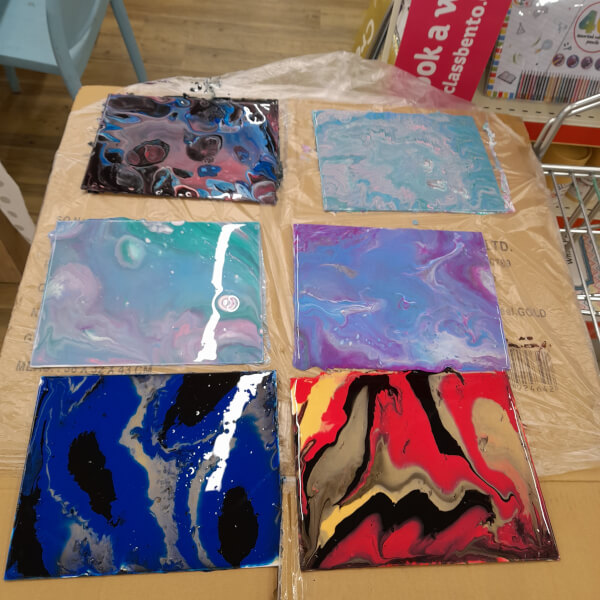
You are a GUI agent. You are given a task and a screenshot of the screen. Output one action in this format:
    pyautogui.click(x=<x>, y=<y>)
    Task: Click on the green paint
    The image size is (600, 600).
    Given the screenshot: What is the action you would take?
    pyautogui.click(x=190, y=284)